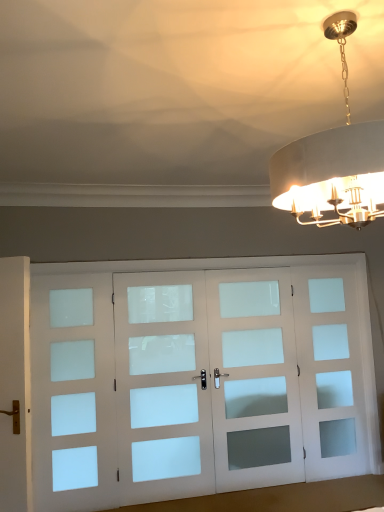
Question: Is white frosted glass screen door at left, which is the 1th screen door from left to right, positioned before white frosted glass screen door at right, the fourth screen door when ordered from left to right?

Choices:
 (A) no
 (B) yes

Answer: (B)

Question: Is white frosted glass screen door at right, the fourth screen door when ordered from left to right, a part of white frosted glass screen door at left, which is the 1th screen door from left to right?

Choices:
 (A) no
 (B) yes

Answer: (A)

Question: Is white frosted glass screen door at left, marked as the 4th screen door in a right-to-left arrangement, taller than white frosted glass screen door at right, the 1th screen door in the right-to-left sequence?

Choices:
 (A) yes
 (B) no

Answer: (A)

Question: Does white frosted glass screen door at left, which is the 1th screen door from left to right, have a lesser width compared to white frosted glass screen door at right, the fourth screen door when ordered from left to right?

Choices:
 (A) yes
 (B) no

Answer: (A)

Question: Is white frosted glass screen door at left, marked as the 4th screen door in a right-to-left arrangement, far away from white frosted glass screen door at right, the 1th screen door in the right-to-left sequence?

Choices:
 (A) no
 (B) yes

Answer: (B)

Question: In the image, is white frosted glass screen door at right, the 1th screen door in the right-to-left sequence, positioned in front of or behind metallic gold chandelier at upper right?

Choices:
 (A) front
 (B) behind

Answer: (B)

Question: From a real-world perspective, is white frosted glass screen door at right, the 1th screen door in the right-to-left sequence, positioned above or below metallic gold chandelier at upper right?

Choices:
 (A) below
 (B) above

Answer: (A)

Question: Looking at their shapes, would you say white frosted glass screen door at right, the 1th screen door in the right-to-left sequence, is wider or thinner than metallic gold chandelier at upper right?

Choices:
 (A) thin
 (B) wide

Answer: (A)

Question: Considering the positions of white frosted glass screen door at right, the fourth screen door when ordered from left to right, and metallic gold chandelier at upper right in the image, is white frosted glass screen door at right, the fourth screen door when ordered from left to right, taller or shorter than metallic gold chandelier at upper right?

Choices:
 (A) tall
 (B) short

Answer: (A)

Question: Is white frosted glass screen door at right, the fourth screen door when ordered from left to right, wider or thinner than white frosted glass door at center, which is the third screen door from right to left?

Choices:
 (A) thin
 (B) wide

Answer: (A)

Question: Based on their positions, is white frosted glass screen door at right, the 1th screen door in the right-to-left sequence, located to the left or right of white frosted glass door at center, which is the third screen door from right to left?

Choices:
 (A) left
 (B) right

Answer: (B)

Question: In the image, is white frosted glass screen door at right, the 1th screen door in the right-to-left sequence, positioned in front of or behind white frosted glass door at center, which is the third screen door from right to left?

Choices:
 (A) front
 (B) behind

Answer: (B)

Question: Looking at the image, does white frosted glass screen door at right, the fourth screen door when ordered from left to right, seem bigger or smaller compared to white frosted glass door at center, which is the third screen door from right to left?

Choices:
 (A) small
 (B) big

Answer: (A)

Question: Is white frosted glass screen door at left, which is the 1th screen door from left to right, to the left or to the right of white frosted glass screen door at center, arranged as the 2th screen door when viewed from the right, in the image?

Choices:
 (A) left
 (B) right

Answer: (A)

Question: Does point (49, 386) appear closer or farther from the camera than point (226, 466)?

Choices:
 (A) farther
 (B) closer

Answer: (B)